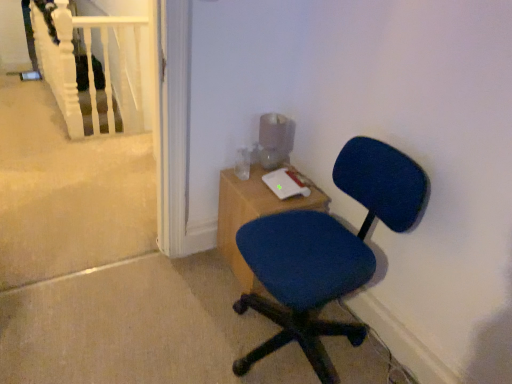
What are the coordinates of `free space in front of wooden desk at center` in the screenshot? It's located at (237, 312).